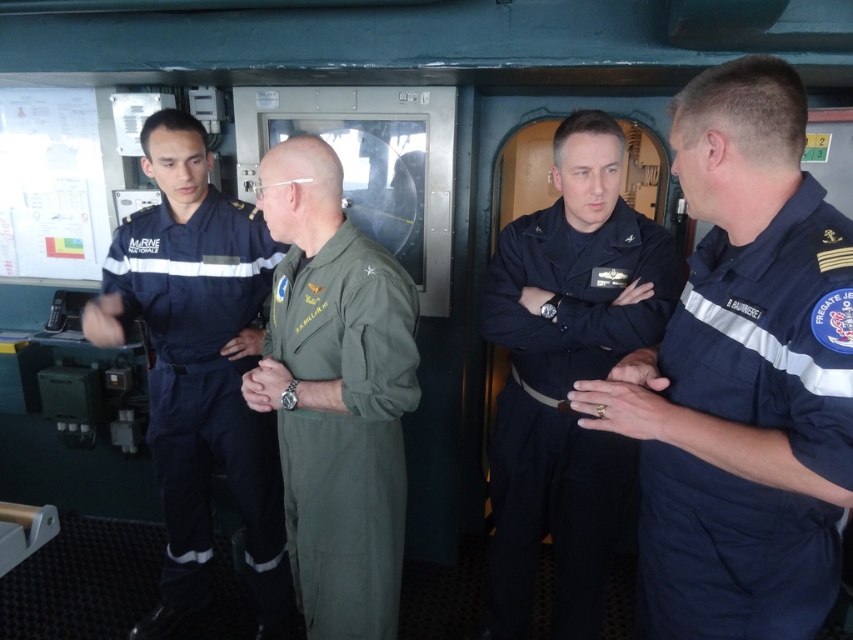
Question: Can you confirm if navy blue cotton shirt at right is positioned below dark blue fabric uniform at center?

Choices:
 (A) yes
 (B) no

Answer: (B)

Question: Can you confirm if navy blue uniform at left is thinner than dark blue fabric uniform at center?

Choices:
 (A) yes
 (B) no

Answer: (B)

Question: Among these points, which one is nearest to the camera?

Choices:
 (A) (720, 244)
 (B) (576, 538)

Answer: (A)

Question: Is dark blue fabric uniform at center further to the viewer compared to green fabric jumpsuit at center?

Choices:
 (A) no
 (B) yes

Answer: (B)

Question: Which object appears farthest from the camera in this image?

Choices:
 (A) dark blue fabric uniform at center
 (B) navy blue uniform at left
 (C) green fabric jumpsuit at center
 (D) navy blue cotton shirt at right

Answer: (B)

Question: Among these points, which one is farthest from the camera?

Choices:
 (A) (177, 314)
 (B) (332, 237)

Answer: (A)